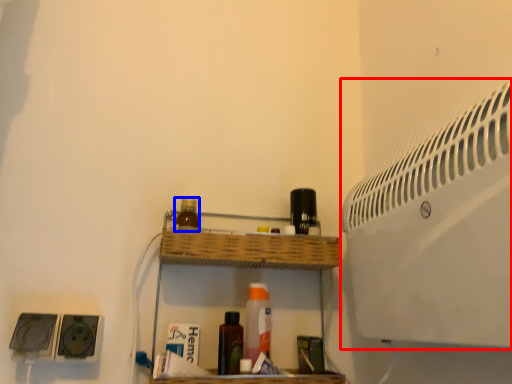
Question: Among these objects, which one is farthest to the camera, air conditioning (highlighted by a red box) or bottle (highlighted by a blue box)?

Choices:
 (A) air conditioning
 (B) bottle

Answer: (B)